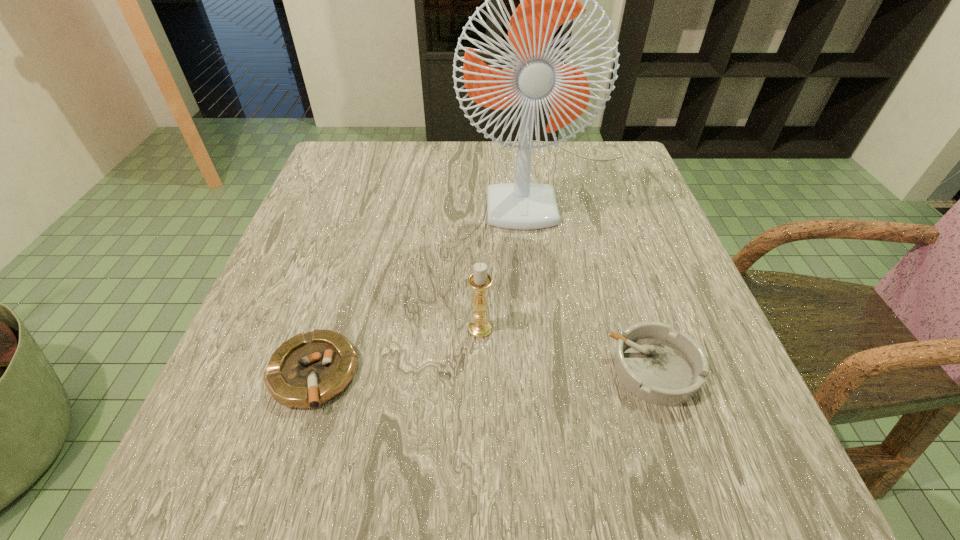
Identify the location of fan. The width and height of the screenshot is (960, 540). (x=547, y=0).

This screenshot has width=960, height=540. What are the coordinates of `the tallest object` in the screenshot? It's located at (547, 0).

The image size is (960, 540). In order to click on candle holder in this screenshot , I will do `click(480, 281)`.

Locate an element on the screen. the right ashtray is located at coordinates (658, 366).

I want to click on the shortest object, so click(x=310, y=369).

At what (x,y) coordinates should I click in order to perform the action: click on the leftmost object. Please return your answer as a coordinate pair (x, y). The image size is (960, 540). Looking at the image, I should click on (310, 369).

The width and height of the screenshot is (960, 540). I want to click on free space located 0.130m on the front-facing side of the tallest object, so click(x=566, y=276).

The width and height of the screenshot is (960, 540). I want to click on vacant space located 0.160m on the back of the second tallest object, so click(480, 255).

Locate an element on the screen. This screenshot has width=960, height=540. vacant area situated 0.100m on the back of the right ashtray is located at coordinates (628, 290).

You are a GUI agent. You are given a task and a screenshot of the screen. Output one action in this format:
    pyautogui.click(x=<x>, y=<y>)
    Task: Click on the vacant space located on the back of the shortest object
    
    Given the screenshot: What is the action you would take?
    pyautogui.click(x=333, y=308)